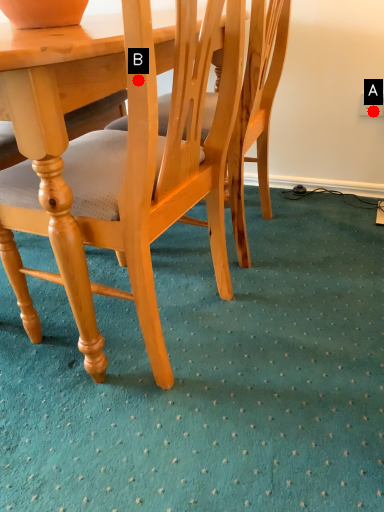
Question: Two points are circled on the image, labeled by A and B beside each circle. Which point appears farthest from the camera in this image?

Choices:
 (A) A is further
 (B) B is further

Answer: (A)